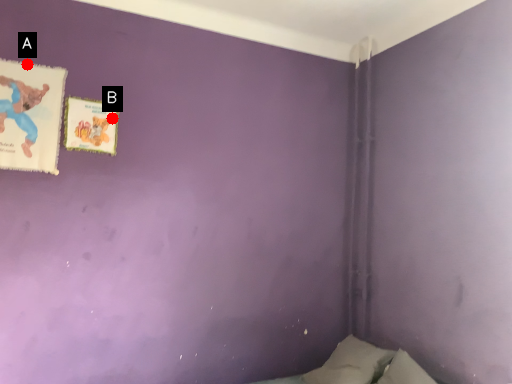
Question: Two points are circled on the image, labeled by A and B beside each circle. Which point is closer to the camera?

Choices:
 (A) A is closer
 (B) B is closer

Answer: (A)